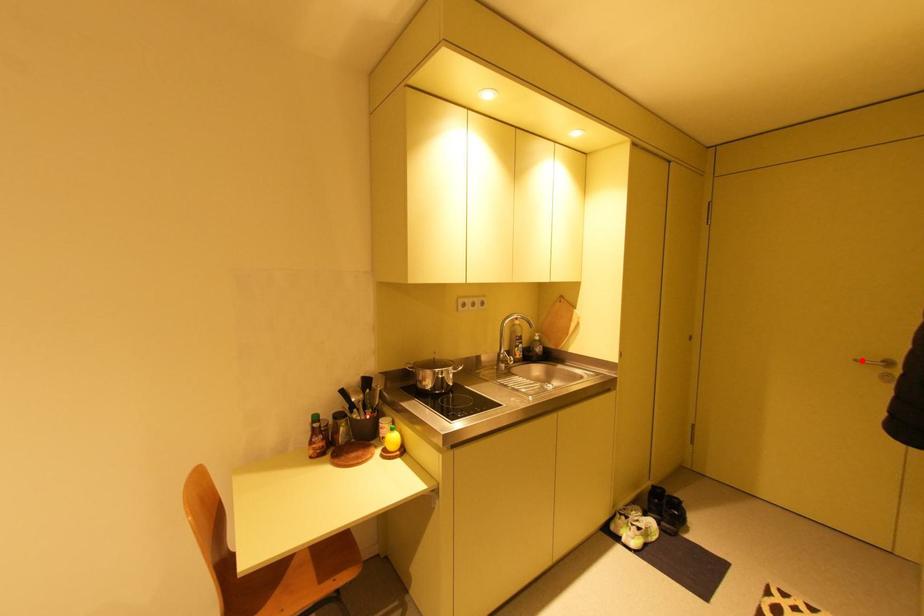
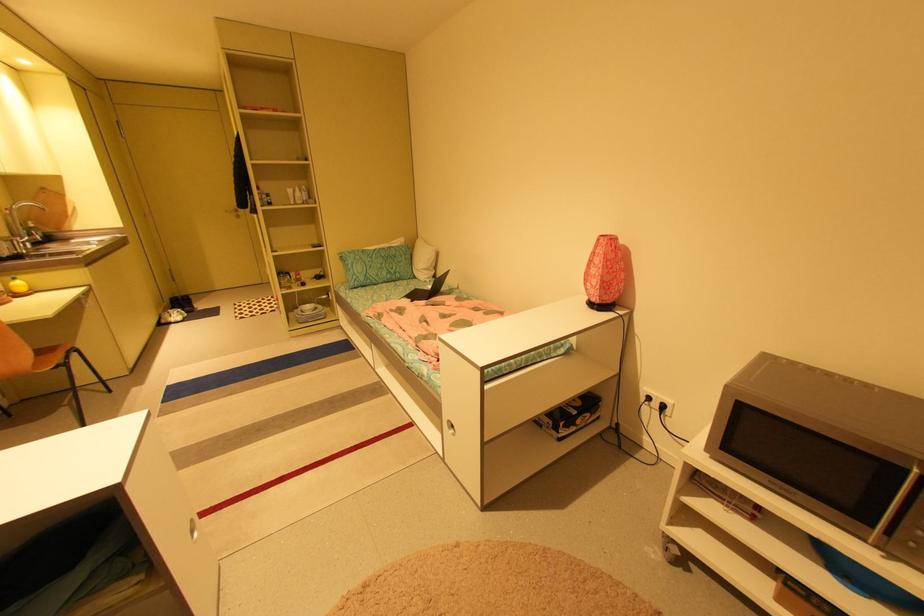
Question: A red point is marked in image1. In image2, is the corresponding 3D point closer to the camera or farther? Reply with the corresponding letter.

Choices:
 (A) The corresponding 3D point is closer.
 (B) The corresponding 3D point is farther.

Answer: (A)